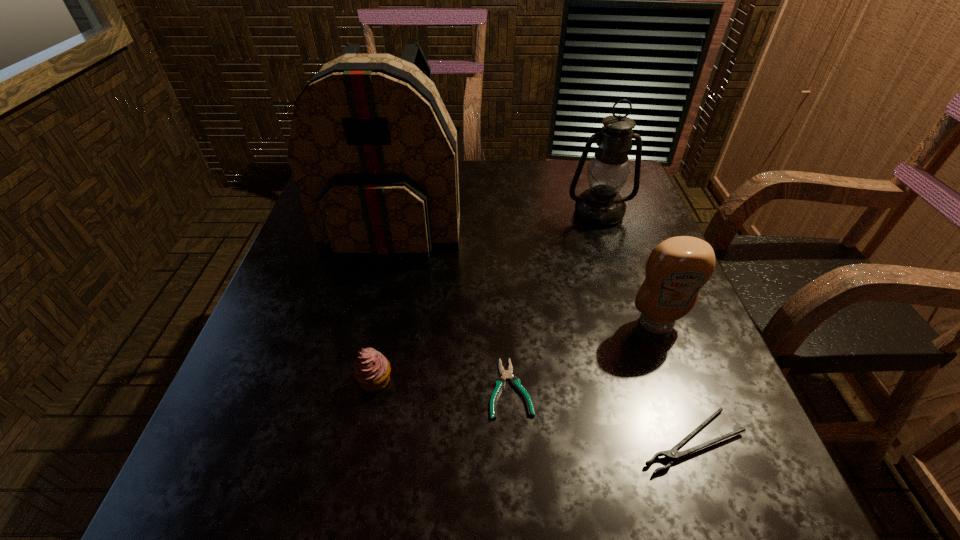
Find the location of a particular element. This screenshot has width=960, height=540. backpack is located at coordinates (373, 151).

At what (x,y) coordinates should I click in order to perform the action: click on the fifth shortest object. Please return your answer as a coordinate pair (x, y). The image size is (960, 540). Looking at the image, I should click on (602, 205).

Locate an element on the screen. Image resolution: width=960 pixels, height=540 pixels. the third tallest object is located at coordinates (677, 268).

This screenshot has width=960, height=540. What are the coordinates of `the fourth nearest object` in the screenshot? It's located at (677, 268).

In order to click on the fourth tallest object in this screenshot , I will do `click(372, 370)`.

In order to click on the second shortest object in this screenshot , I will do `click(672, 454)`.

This screenshot has width=960, height=540. I want to click on the third object from left to right, so [x=500, y=382].

In order to click on the shortest object in this screenshot , I will do `click(500, 382)`.

I want to click on free space located on the front face of the backpack, so click(381, 280).

Identify the location of free region located 0.200m on the left of the fifth shortest object. The image size is (960, 540). (492, 213).